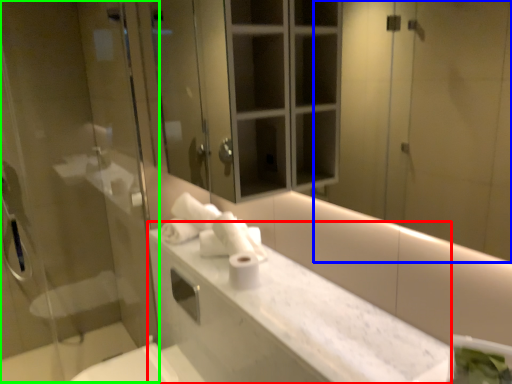
Question: Estimate the real-world distances between objects in this image. Which object is farther from counter top (highlighted by a red box), mirror (highlighted by a blue box) or screen door (highlighted by a green box)?

Choices:
 (A) mirror
 (B) screen door

Answer: (A)